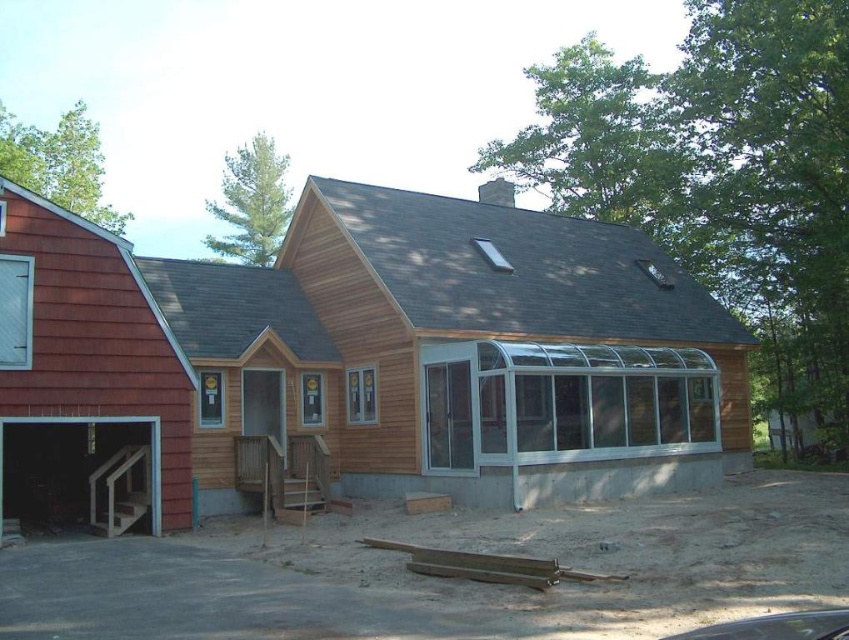
You are standing at the base of the matte wood stairs at lower left and want to reach the wooden barn at center. Which direction should you face to walk towards the barn?

The wooden barn at center is taller than the matte wood stairs at lower left. Since you are at the base of the stairs, facing the barn would mean turning towards the center of the image where the barn is located, which is higher in elevation. Walk towards the wooden barn at center by facing the center direction.

You are a contractor assessing the construction site. You need to determine which object, the wooden barn at center or the matte wood stairs at lower left, requires more materials for its current structure. Based on the scene, which one would you prioritize?

The wooden barn at center is bigger than the matte wood stairs at lower left, so it would require more materials and should be prioritized.

You are standing at the base of the matte wood stairs at lower left and want to reach the wooden barn at center. Which direction should you move to get there?

You should move upward because the wooden barn at center is above the matte wood stairs at lower left.